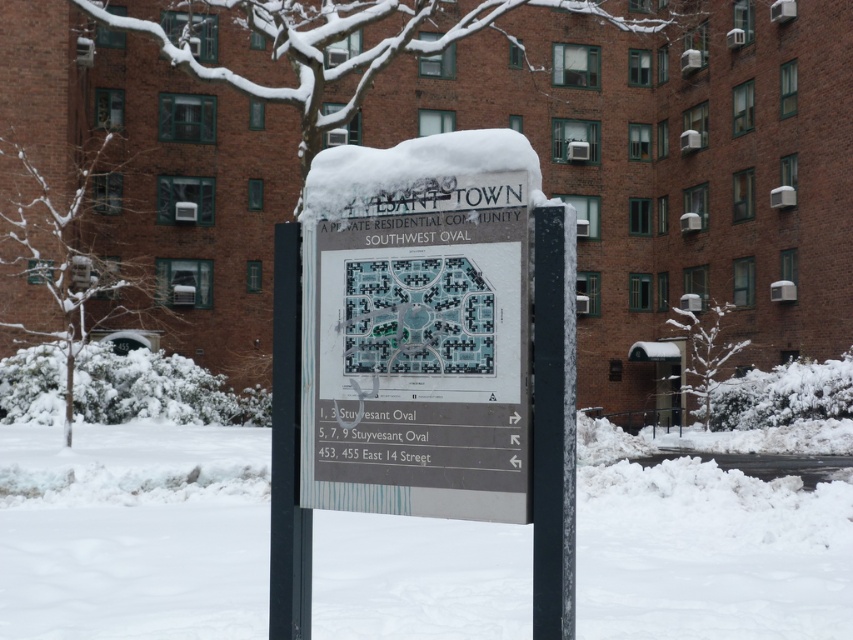
Question: Which point is farther to the camera?

Choices:
 (A) black plastic pole at center
 (B) black metal pole at center

Answer: (B)

Question: Is white powdery snow at lower center positioned at the back of black metal pole at center?

Choices:
 (A) yes
 (B) no

Answer: (B)

Question: Can you confirm if white powdery snow at lower center is wider than black plastic pole at center?

Choices:
 (A) yes
 (B) no

Answer: (A)

Question: Can you confirm if black plastic pole at center is bigger than black metal pole at center?

Choices:
 (A) no
 (B) yes

Answer: (A)

Question: Which object is positioned closest to the black metal pole at center?

Choices:
 (A) white plastic sign at center
 (B) white powdery snow at lower center

Answer: (B)

Question: Which point appears closest to the camera in this image?

Choices:
 (A) (114, 540)
 (B) (274, 637)
 (C) (50, 273)
 (D) (572, 296)

Answer: (D)